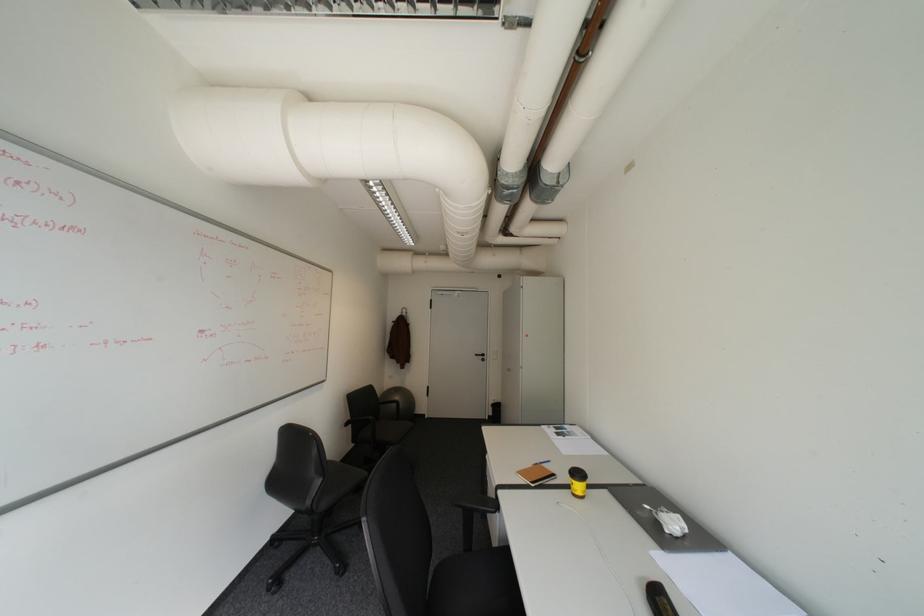
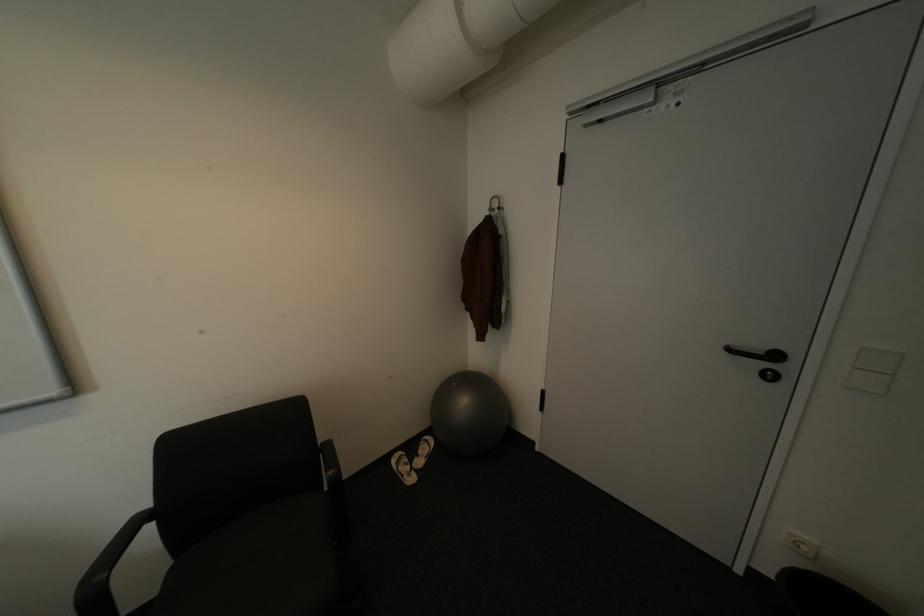
The point at (x=485, y=355) is marked in the first image. Where is the corresponding point in the second image?

(739, 350)